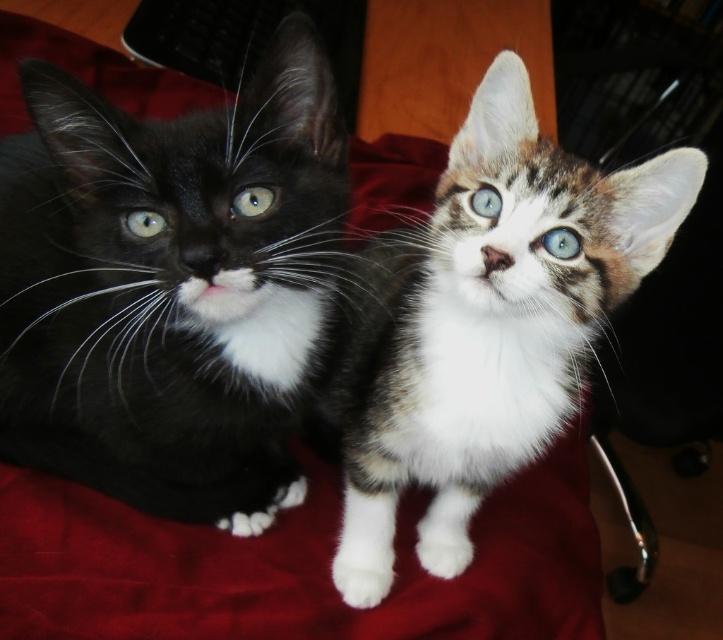
Image resolution: width=723 pixels, height=640 pixels. What are the coordinates of `green glossy eye at center` in the screenshot? It's located at (252, 202).

Is the position of green glossy eye at center more distant than that of blue glossy eye at center?

No, green glossy eye at center is closer to the viewer.

Image resolution: width=723 pixels, height=640 pixels. Describe the element at coordinates (252, 202) in the screenshot. I see `green glossy eye at center` at that location.

Find the location of `green glossy eye at center`. green glossy eye at center is located at coordinates (252, 202).

Is green glossy eye at left positioned in front of blue glossy eye at upper center?

Yes, it is.

Who is positioned more to the right, green glossy eye at left or blue glossy eye at upper center?

Positioned to the right is blue glossy eye at upper center.

Does point (163, 225) come farther from viewer compared to point (470, 198)?

That is False.

At what (x,y) coordinates should I click in order to perform the action: click on green glossy eye at left. Please return your answer as a coordinate pair (x, y). Looking at the image, I should click on (145, 224).

Who is higher up, blue glossy eye at center or blue glossy eye at upper center?

blue glossy eye at upper center is higher up.

Does blue glossy eye at center appear under blue glossy eye at upper center?

Yes.

Where is `blue glossy eye at center`? The width and height of the screenshot is (723, 640). blue glossy eye at center is located at coordinates (560, 243).

Identify the location of blue glossy eye at center. (560, 243).